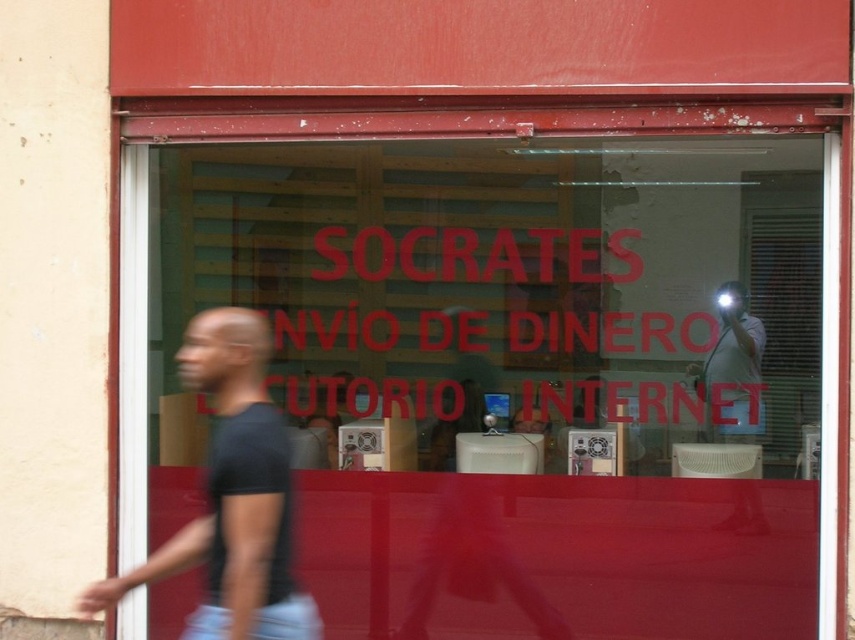
Question: Does black matte shirt at left appear on the left side of white glossy camera at upper right?

Choices:
 (A) yes
 (B) no

Answer: (A)

Question: Does black matte shirt at left have a greater width compared to white glossy camera at upper right?

Choices:
 (A) no
 (B) yes

Answer: (B)

Question: Observing the image, what is the correct spatial positioning of black matte shirt at left in reference to white glossy camera at upper right?

Choices:
 (A) above
 (B) below

Answer: (B)

Question: Which of the following is the closest to the observer?

Choices:
 (A) black matte shirt at left
 (B) white glossy camera at upper right

Answer: (A)

Question: Among these objects, which one is nearest to the camera?

Choices:
 (A) white glossy camera at upper right
 (B) black matte shirt at left

Answer: (B)

Question: Which point is closer to the camera?

Choices:
 (A) (746, 378)
 (B) (221, 529)

Answer: (B)